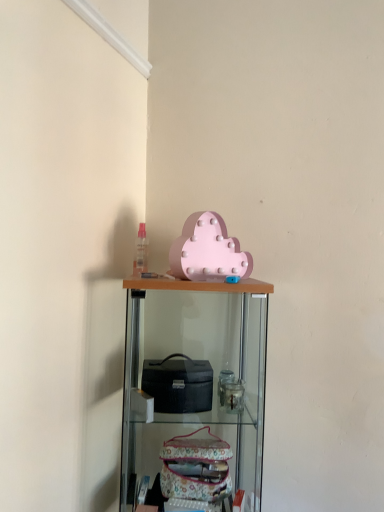
Identify the location of wooden shelf at center. (193, 391).

Image resolution: width=384 pixels, height=512 pixels. Describe the element at coordinates (193, 391) in the screenshot. I see `wooden shelf at center` at that location.

Where is `matte pink cloud at upper center`? The image size is (384, 512). matte pink cloud at upper center is located at coordinates (208, 250).

What do you see at coordinates (208, 250) in the screenshot? I see `matte pink cloud at upper center` at bounding box center [208, 250].

Locate an element on the screen. The height and width of the screenshot is (512, 384). wooden shelf at center is located at coordinates (193, 391).

From the picture: Is matte pink cloud at upper center to the left or to the right of wooden shelf at center in the image?

Clearly, matte pink cloud at upper center is on the right of wooden shelf at center in the image.

Who is more distant, matte pink cloud at upper center or wooden shelf at center?

Positioned behind is matte pink cloud at upper center.

Does point (226, 231) come closer to viewer compared to point (153, 385)?

No, (226, 231) is behind (153, 385).

From the image's perspective, which one is positioned higher, matte pink cloud at upper center or wooden shelf at center?

matte pink cloud at upper center appears higher in the image.

From a real-world perspective, who is located higher, matte pink cloud at upper center or wooden shelf at center?

matte pink cloud at upper center, from a real-world perspective.

Which object is wider, matte pink cloud at upper center or wooden shelf at center?

wooden shelf at center is wider.

Considering the sizes of objects matte pink cloud at upper center and wooden shelf at center in the image provided, who is taller, matte pink cloud at upper center or wooden shelf at center?

Standing taller between the two is wooden shelf at center.

Can you confirm if matte pink cloud at upper center is bigger than wooden shelf at center?

Actually, matte pink cloud at upper center might be smaller than wooden shelf at center.

Is matte pink cloud at upper center located outside wooden shelf at center?

Yes.

Is matte pink cloud at upper center far from wooden shelf at center?

No, matte pink cloud at upper center is not far away from wooden shelf at center.

Could you tell me if matte pink cloud at upper center is facing wooden shelf at center?

No, matte pink cloud at upper center is not aimed at wooden shelf at center.

Can you tell me how much matte pink cloud at upper center and wooden shelf at center differ in facing direction?

matte pink cloud at upper center and wooden shelf at center are facing 44.3 degrees away from each other.

Where is `shelf that appears below the matte pink cloud at upper center (from a real-world perspective)`? The width and height of the screenshot is (384, 512). shelf that appears below the matte pink cloud at upper center (from a real-world perspective) is located at coordinates (193, 391).

Is wooden shelf at center to the left or to the right of matte pink cloud at upper center in the image?

In the image, wooden shelf at center appears on the left side of matte pink cloud at upper center.

Considering the positions of objects wooden shelf at center and matte pink cloud at upper center in the image provided, who is in front, wooden shelf at center or matte pink cloud at upper center?

Positioned in front is wooden shelf at center.

Which is nearer, (159, 410) or (218, 247)?

The point (159, 410) is in front.

From the image's perspective, which object appears higher, wooden shelf at center or matte pink cloud at upper center?

matte pink cloud at upper center is shown above in the image.

From a real-world perspective, is wooden shelf at center positioned under matte pink cloud at upper center based on gravity?

Indeed, from a real-world perspective, wooden shelf at center is positioned beneath matte pink cloud at upper center.

Considering the relative sizes of wooden shelf at center and matte pink cloud at upper center in the image provided, is wooden shelf at center thinner than matte pink cloud at upper center?

In fact, wooden shelf at center might be wider than matte pink cloud at upper center.

Which of these two, wooden shelf at center or matte pink cloud at upper center, stands shorter?

Standing shorter between the two is matte pink cloud at upper center.

Considering the sizes of wooden shelf at center and matte pink cloud at upper center in the image, is wooden shelf at center bigger or smaller than matte pink cloud at upper center?

Clearly, wooden shelf at center is larger in size than matte pink cloud at upper center.

Would you say wooden shelf at center is outside matte pink cloud at upper center?

Yes, wooden shelf at center is outside of matte pink cloud at upper center.

Would you say wooden shelf at center is a long distance from matte pink cloud at upper center?

Actually, wooden shelf at center and matte pink cloud at upper center are a little close together.

Could you tell me if wooden shelf at center is turned towards matte pink cloud at upper center?

No, wooden shelf at center is not facing towards matte pink cloud at upper center.

What are the coordinates of `toy above the wooden shelf at center (from the image's perspective)` in the screenshot? It's located at (208, 250).

The height and width of the screenshot is (512, 384). Identify the location of shelf on the left of matte pink cloud at upper center. (193, 391).

Image resolution: width=384 pixels, height=512 pixels. In order to click on shelf in front of the matte pink cloud at upper center in this screenshot , I will do `click(193, 391)`.